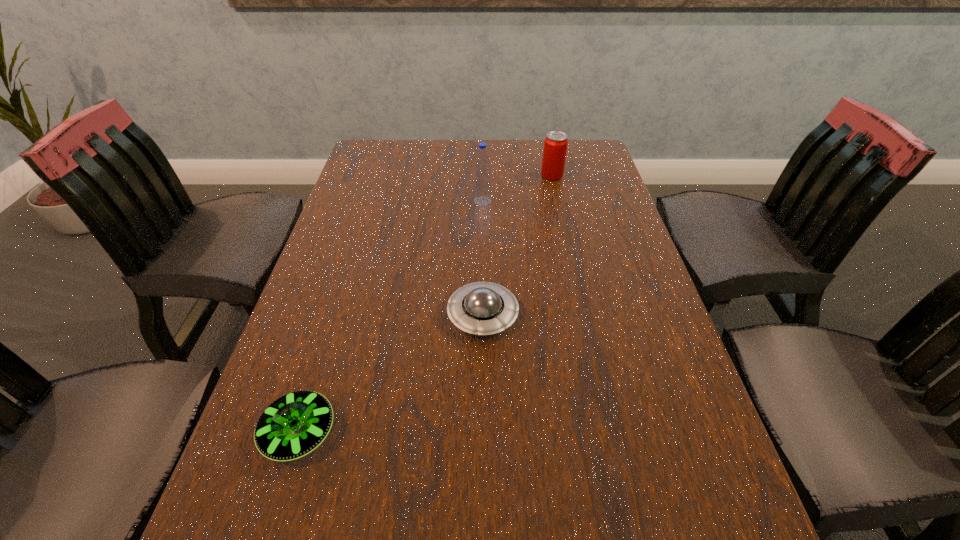
Locate an element on the screen. This screenshot has width=960, height=540. free space between the tallest object and the right saucer is located at coordinates point(483,258).

I want to click on object that ranks as the closest to the farthest object, so click(482, 184).

Select which object is the third closest to the left saucer. Please provide its 2D coordinates. Your answer should be formatted as a tuple, i.e. [(x, y)], where the tuple contains the x and y coordinates of a point satisfying the conditions above.

[(555, 145)]

Locate an element on the screen. The width and height of the screenshot is (960, 540). free space that satisfies the following two spatial constraints: 1. on the back side of the left saucer; 2. on the left side of the farthest object is located at coordinates (379, 176).

Locate an element on the screen. The width and height of the screenshot is (960, 540). vacant position in the image that satisfies the following two spatial constraints: 1. on the back side of the can; 2. on the left side of the left saucer is located at coordinates (379, 176).

The height and width of the screenshot is (540, 960). I want to click on vacant region that satisfies the following two spatial constraints: 1. on the back side of the third farthest object; 2. on the left side of the nearer saucer, so click(336, 315).

You are a GUI agent. You are given a task and a screenshot of the screen. Output one action in this format:
    pyautogui.click(x=<x>, y=<y>)
    Task: Click on the free spot that satisfies the following two spatial constraints: 1. on the back side of the leftmost object; 2. on the left side of the farther saucer
    
    Given the screenshot: What is the action you would take?
    pyautogui.click(x=336, y=315)